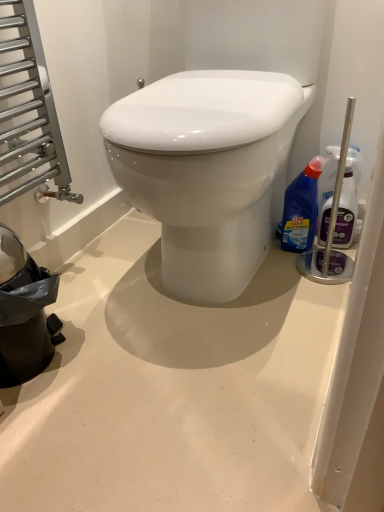
Identify the location of vacant space in front of blue plastic bottle at right, which appears as the 2th bottle when viewed from the right. (307, 276).